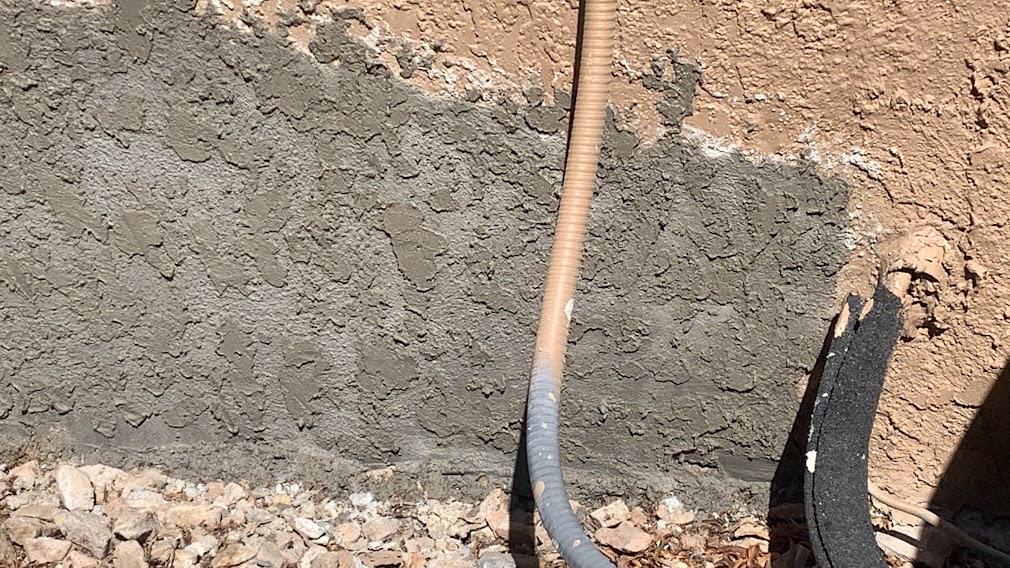
Where is `grey wall`? Image resolution: width=1010 pixels, height=568 pixels. grey wall is located at coordinates (409, 214).